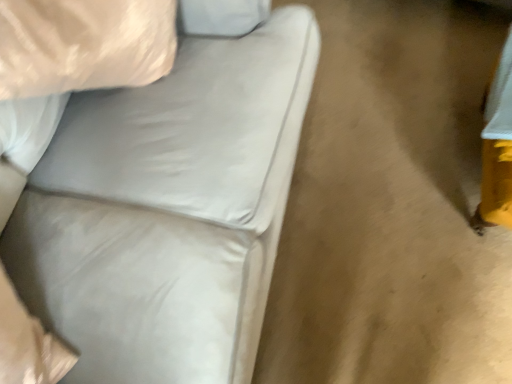
In order to face suede-like gray couch at upper left, should I rotate leftwards or rightwards?

To face it directly, rotate right by 10.332 degrees.

Where is `suede-like gray couch at upper left`? suede-like gray couch at upper left is located at coordinates (168, 210).

Describe the element at coordinates (168, 210) in the screenshot. I see `suede-like gray couch at upper left` at that location.

Identify the location of suede-like gray couch at upper left. (168, 210).